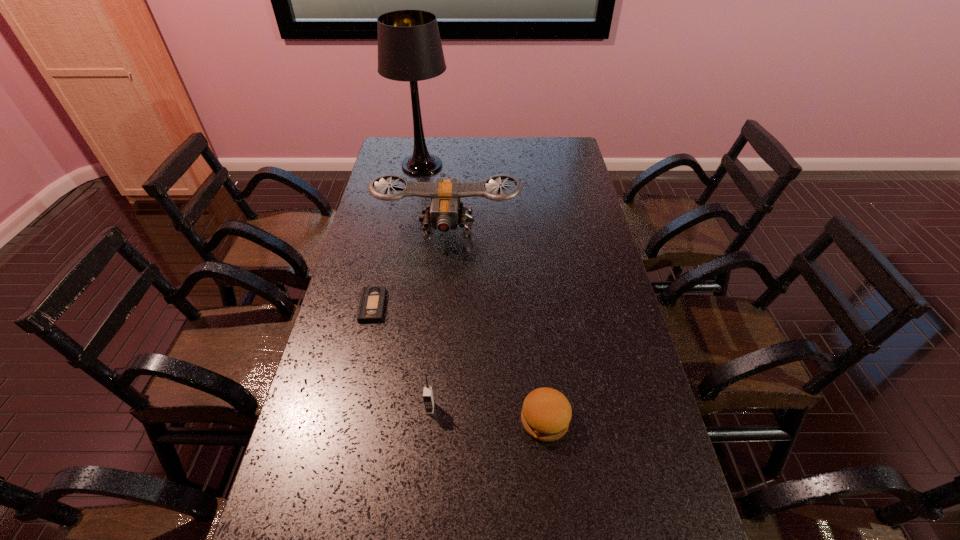
Locate which object is the fourth closest to the second farthest object. Please provide its 2D coordinates. Your answer should be formatted as a tuple, i.e. [(x, y)], where the tuple contains the x and y coordinates of a point satisfying the conditions above.

[(428, 398)]

Find the location of a particular element. Image resolution: width=960 pixels, height=540 pixels. object that is the second closest to the second farthest object is located at coordinates [409, 45].

What are the coordinates of `blank space that satisfies the following two spatial constraints: 1. on the front-facing side of the third shortest object; 2. on the right side of the hamburger` in the screenshot? It's located at coord(429,420).

The width and height of the screenshot is (960, 540). Find the location of `free location that satisfies the following two spatial constraints: 1. on the front-facing side of the third tallest object; 2. on the left side of the hamburger`. free location that satisfies the following two spatial constraints: 1. on the front-facing side of the third tallest object; 2. on the left side of the hamburger is located at coordinates (429, 420).

Find the location of a particular element. vacant region that satisfies the following two spatial constraints: 1. on the front-facing side of the hamburger; 2. on the right side of the second tallest object is located at coordinates (432, 420).

Where is `free space that satisfies the following two spatial constraints: 1. on the back side of the shortest object; 2. on the right side of the farthest object`? The image size is (960, 540). free space that satisfies the following two spatial constraints: 1. on the back side of the shortest object; 2. on the right side of the farthest object is located at coordinates (405, 166).